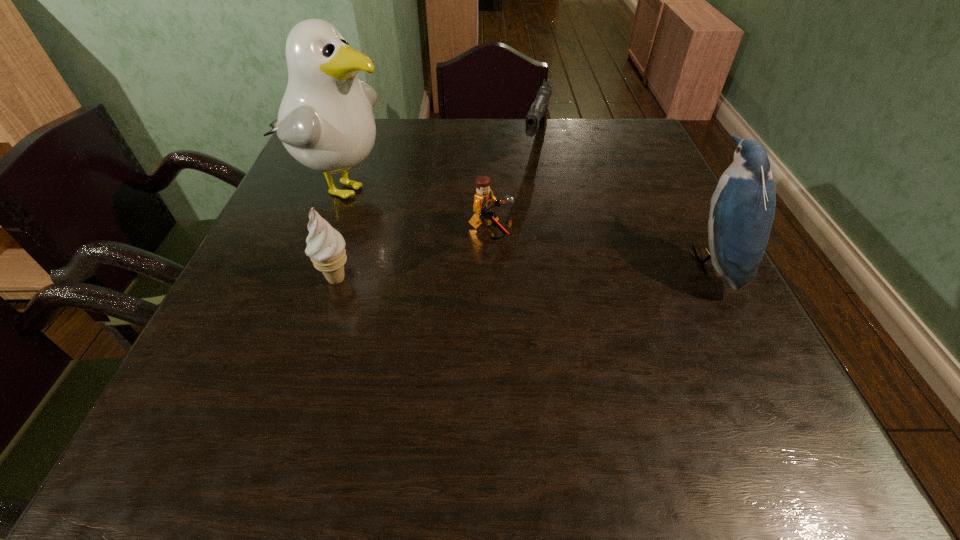
Locate an element on the screen. Image resolution: width=960 pixels, height=540 pixels. free spot on the desktop that is between the icecream and the bird and is positioned in the direction the gun is aimed is located at coordinates (482, 272).

Where is `free spot on the desktop that is between the third shortest object and the rightmost object and is positioned holding a crossbow in the hands of the Lego`? free spot on the desktop that is between the third shortest object and the rightmost object and is positioned holding a crossbow in the hands of the Lego is located at coordinates (577, 268).

The image size is (960, 540). What are the coordinates of `free spot on the desktop that is between the icecream and the rightmost object and is positioned on the beak of the tallest object` in the screenshot? It's located at (567, 268).